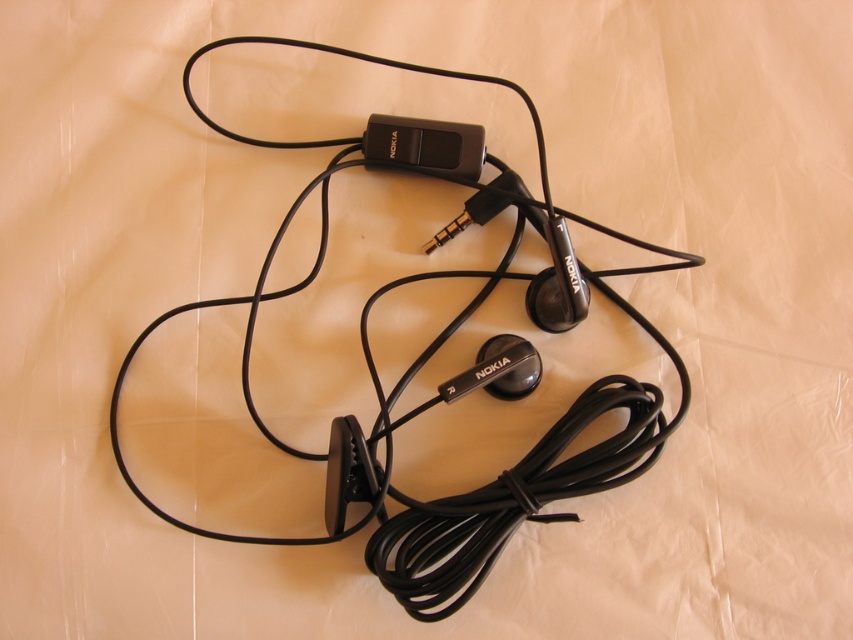
Where is `black rubber cable at center`? black rubber cable at center is located at coordinates (459, 392).

Between black rubber cable at center and black plastic ipod at center, which one has more height?

black rubber cable at center is taller.

Image resolution: width=853 pixels, height=640 pixels. Describe the element at coordinates (459, 392) in the screenshot. I see `black rubber cable at center` at that location.

Locate an element on the screen. black rubber cable at center is located at coordinates (459, 392).